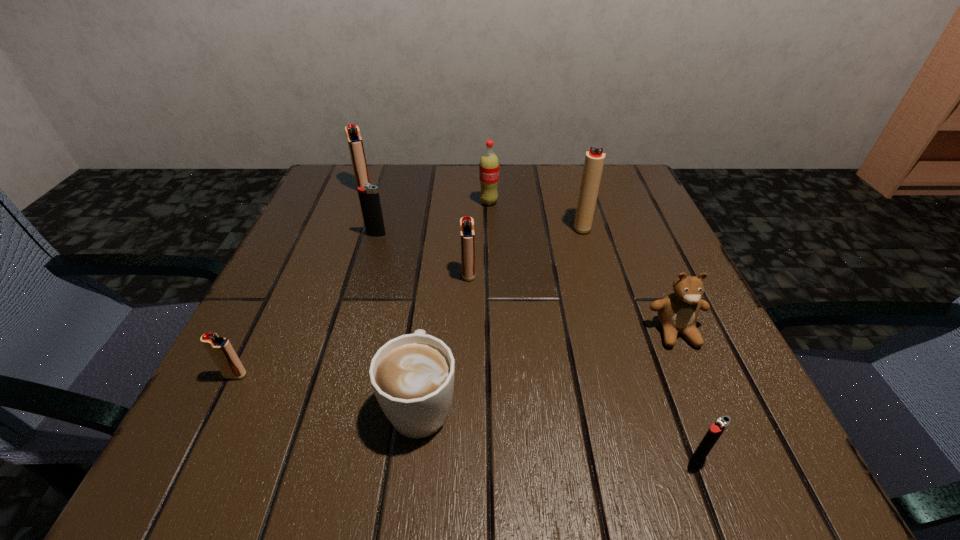
Select which object is the fourth closest to the rightmost igniter. Please provide its 2D coordinates. Your answer should be formatted as a tuple, i.e. [(x, y)], where the tuple contains the x and y coordinates of a point satisfying the conditions above.

[(594, 160)]

This screenshot has width=960, height=540. I want to click on object that is the fifth closest to the second object from left to right, so click(412, 376).

What are the coordinates of `igniter that stands as the third closest to the third object from left to right` in the screenshot? It's located at (221, 351).

Locate an element on the screen. igniter that is the fifth closest to the tallest object is located at coordinates (221, 351).

Find the location of a particular element. The height and width of the screenshot is (540, 960). red igniter that is the closest to the farthest red igniter is located at coordinates (467, 235).

Where is `red igniter identified as the second closest to the farthest igniter`? Image resolution: width=960 pixels, height=540 pixels. red igniter identified as the second closest to the farthest igniter is located at coordinates (594, 160).

Locate an element on the screen. This screenshot has height=540, width=960. blank area in the image that satisfies the following two spatial constraints: 1. on the front side of the second nearest red igniter; 2. on the left side of the nearest igniter is located at coordinates (463, 459).